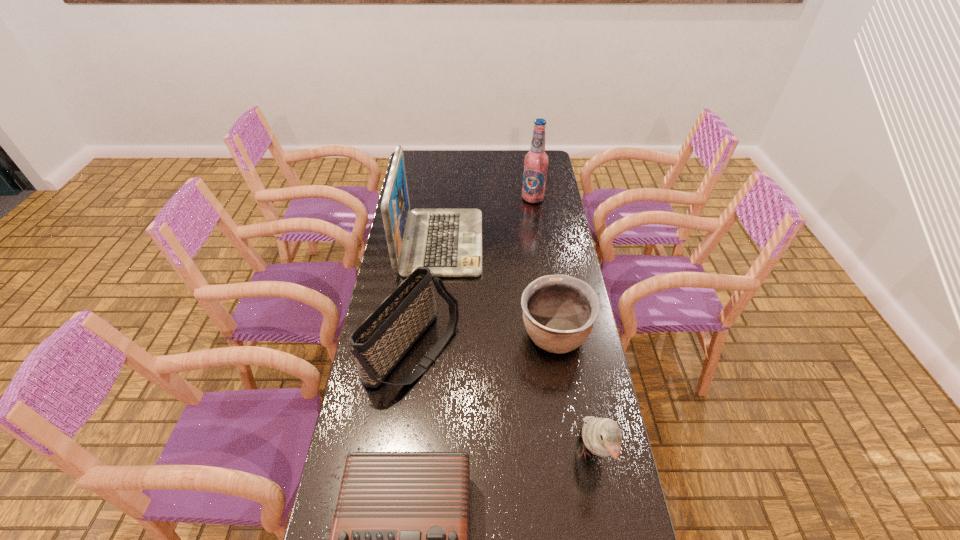
Find the location of `free spot between the second farthest object and the alcohol`. free spot between the second farthest object and the alcohol is located at coordinates (487, 220).

Find the location of a particular element. This screenshot has width=960, height=540. the fourth closest object relative to the pottery is located at coordinates (x=400, y=535).

Select which object is the fifth closest to the radio receiver. Please provide its 2D coordinates. Your answer should be formatted as a tuple, i.e. [(x, y)], where the tuple contains the x and y coordinates of a point satisfying the conditions above.

[(536, 161)]

Where is `free region that satisfies the following two spatial constraints: 1. on the screen of the fifth nearest object; 2. on the right side of the pottery`? free region that satisfies the following two spatial constraints: 1. on the screen of the fifth nearest object; 2. on the right side of the pottery is located at coordinates (432, 336).

Locate an element on the screen. free point that satisfies the following two spatial constraints: 1. on the screen of the second farthest object; 2. on the front side of the handbag is located at coordinates (430, 352).

Image resolution: width=960 pixels, height=540 pixels. Identify the location of vacant space that satisfies the following two spatial constraints: 1. on the front side of the farthest object; 2. on the screen of the second farthest object. (540, 243).